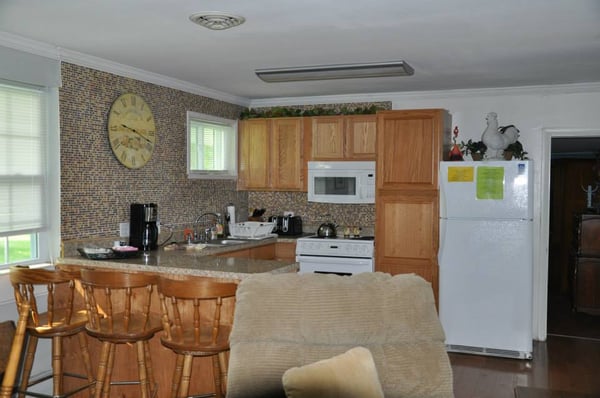
The height and width of the screenshot is (398, 600). Identify the location of clock. (127, 110).